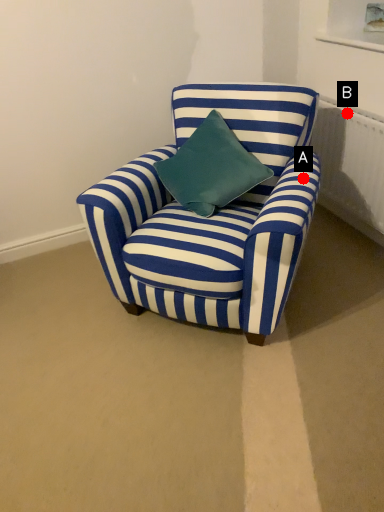
Question: Two points are circled on the image, labeled by A and B beside each circle. Which point appears closest to the camera in this image?

Choices:
 (A) A is closer
 (B) B is closer

Answer: (A)